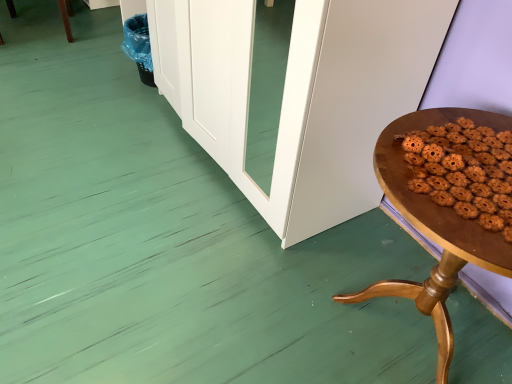
Locate an element on the screen. The image size is (512, 384). free point above wooden table at right (from a real-world perspective) is located at coordinates (466, 163).